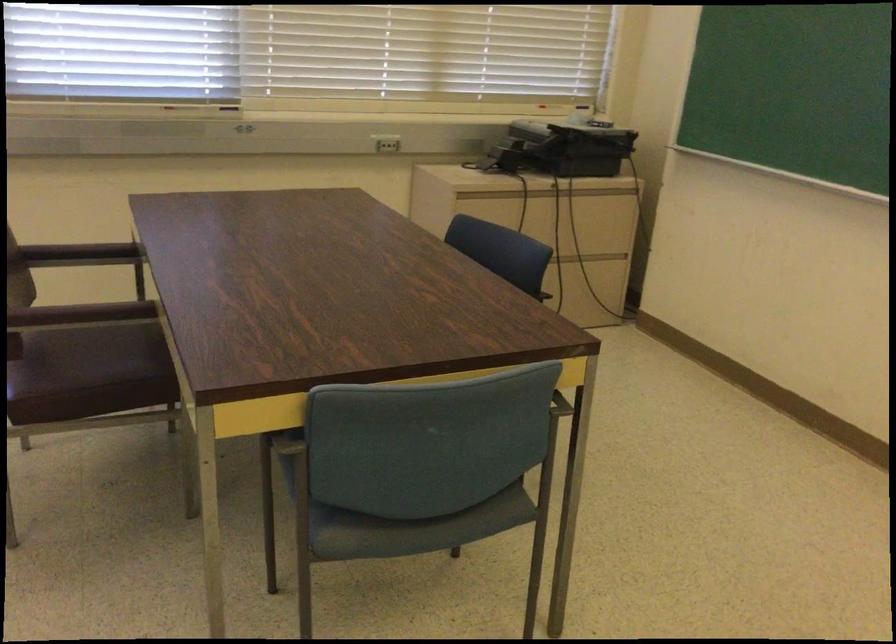
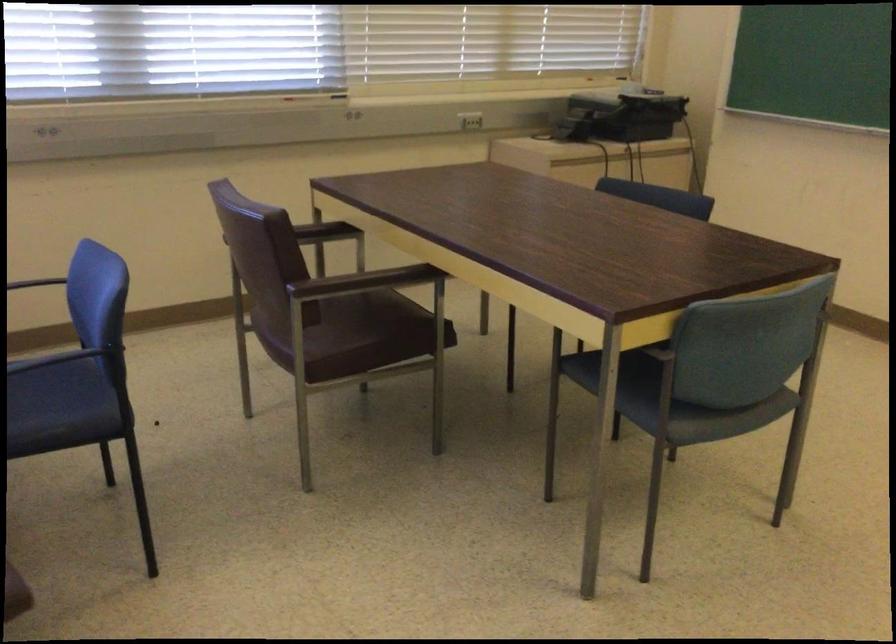
Find the pixel in the second image that matches [104,373] in the first image.

(371, 330)